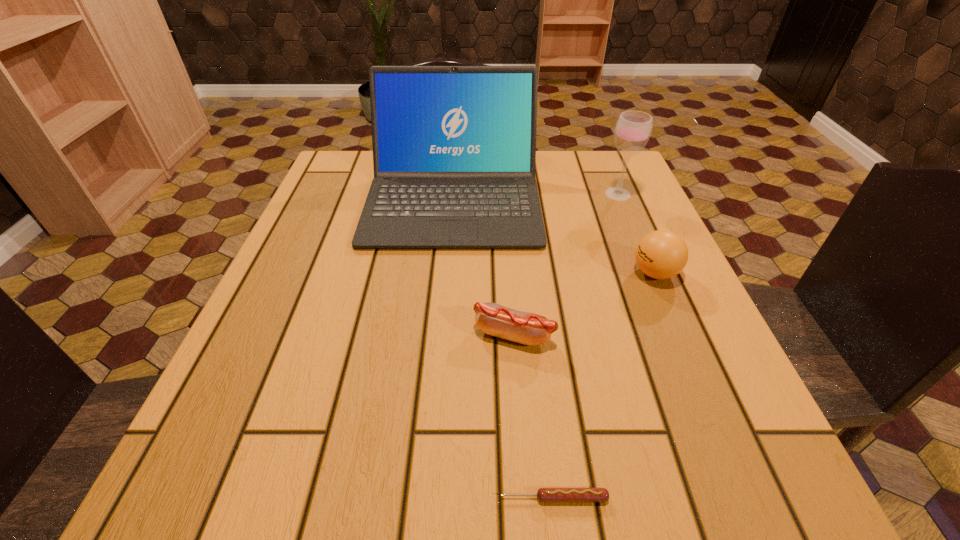
Find the location of `free space that is in between the third farthest object and the wineglass`. free space that is in between the third farthest object and the wineglass is located at coordinates (636, 233).

I want to click on vacant region between the third farthest object and the second shortest object, so click(585, 304).

The width and height of the screenshot is (960, 540). I want to click on empty location between the wineglass and the shortest object, so click(586, 346).

At what (x,y) coordinates should I click in order to perform the action: click on free spot between the third shortest object and the laptop computer. Please return your answer as a coordinate pair (x, y). Looking at the image, I should click on (554, 235).

Locate an element on the screen. This screenshot has height=540, width=960. vacant point located between the taller sausage and the third farthest object is located at coordinates (585, 304).

The width and height of the screenshot is (960, 540). I want to click on free space between the ping-pong ball and the tallest object, so click(554, 235).

Where is `vacant region between the third nearest object and the taller sausage`? This screenshot has width=960, height=540. vacant region between the third nearest object and the taller sausage is located at coordinates (585, 304).

Where is `unoccupied position between the second tallest object and the nearest object`? unoccupied position between the second tallest object and the nearest object is located at coordinates (586, 346).

Where is `free space between the taller sausage and the third farthest object`? free space between the taller sausage and the third farthest object is located at coordinates (x=585, y=304).

Find the location of a particular element. object that stands as the closest to the shortest object is located at coordinates point(532,329).